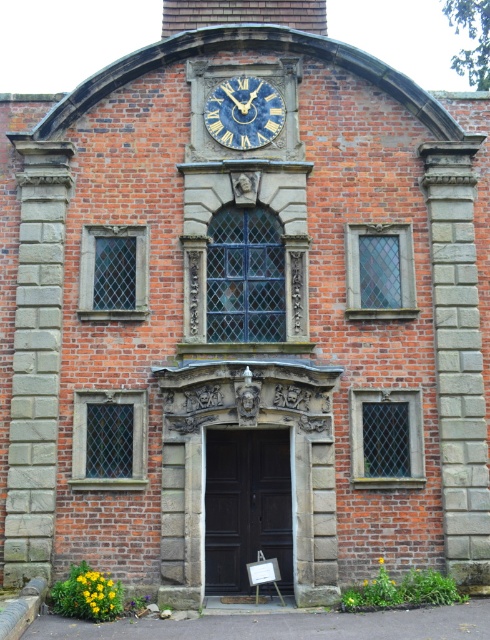
Is dark wood door at center below blue-golden clock at upper center?

Correct, dark wood door at center is located below blue-golden clock at upper center.

Does dark wood door at center lie in front of blue-golden clock at upper center?

Yes, dark wood door at center is closer to the viewer.

Image resolution: width=490 pixels, height=640 pixels. In order to click on dark wood door at center in this screenshot , I will do `click(246, 506)`.

Image resolution: width=490 pixels, height=640 pixels. I want to click on dark wood door at center, so click(x=246, y=506).